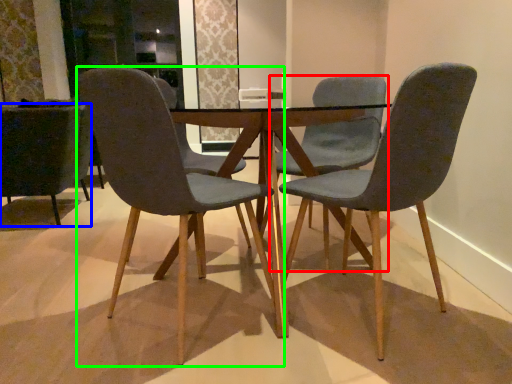
Question: Estimate the real-world distances between objects in this image. Which object is farther from chair (highlighted by a red box), chair (highlighted by a blue box) or chair (highlighted by a green box)?

Choices:
 (A) chair
 (B) chair

Answer: (A)